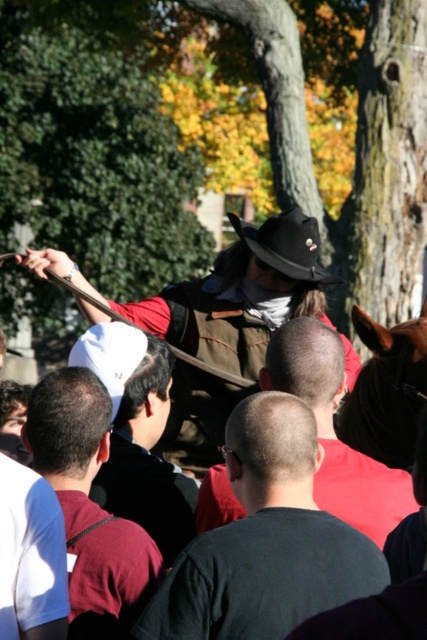
Question: Which object is farther from the camera taking this photo?

Choices:
 (A) brown leather hat at center
 (B) black matte shirt at center
 (C) maroon shirt at center

Answer: (A)

Question: Does maroon shirt at center appear on the left side of white cloth cap at center?

Choices:
 (A) yes
 (B) no

Answer: (A)

Question: Among these objects, which one is nearest to the camera?

Choices:
 (A) maroon shirt at center
 (B) brown leather hat at center

Answer: (A)

Question: Which point is farther to the camera?

Choices:
 (A) maroon shirt at center
 (B) white cotton cap at upper left
 (C) black matte shirt at center
 (D) black felt cowboy hat at center

Answer: (D)

Question: Does brown leather hat at center lie behind white cotton cap at upper left?

Choices:
 (A) no
 (B) yes

Answer: (B)

Question: Does black matte shirt at center have a larger size compared to brown leather jacket at center?

Choices:
 (A) yes
 (B) no

Answer: (A)